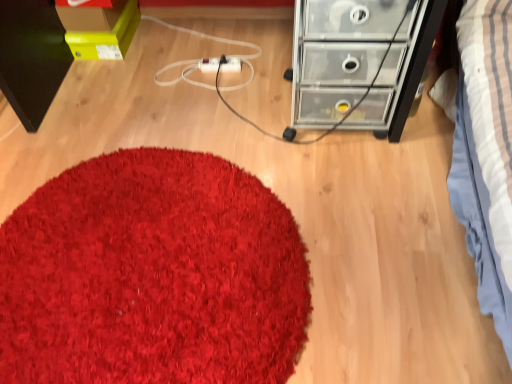
Question: Can shaggy red carpet at center be found inside transparent plastic chest of drawers at upper right?

Choices:
 (A) yes
 (B) no

Answer: (B)

Question: From a real-world perspective, is transparent plastic chest of drawers at upper right under shaggy red carpet at center?

Choices:
 (A) yes
 (B) no

Answer: (B)

Question: Are transparent plastic chest of drawers at upper right and shaggy red carpet at center beside each other?

Choices:
 (A) no
 (B) yes

Answer: (A)

Question: Considering the relative sizes of transparent plastic chest of drawers at upper right and shaggy red carpet at center in the image provided, is transparent plastic chest of drawers at upper right shorter than shaggy red carpet at center?

Choices:
 (A) yes
 (B) no

Answer: (B)

Question: Does transparent plastic chest of drawers at upper right have a lesser width compared to shaggy red carpet at center?

Choices:
 (A) yes
 (B) no

Answer: (A)

Question: Considering their positions, is transparent plastic chest of drawers at upper right located in front of or behind shaggy red carpet at center?

Choices:
 (A) front
 (B) behind

Answer: (B)

Question: Is transparent plastic chest of drawers at upper right wider or thinner than shaggy red carpet at center?

Choices:
 (A) wide
 (B) thin

Answer: (B)

Question: Would you say transparent plastic chest of drawers at upper right is inside or outside shaggy red carpet at center?

Choices:
 (A) outside
 (B) inside

Answer: (A)

Question: From a real-world perspective, is transparent plastic chest of drawers at upper right positioned above or below shaggy red carpet at center?

Choices:
 (A) below
 (B) above

Answer: (B)

Question: From the image's perspective, is shaggy red carpet at center located above or below transparent plastic chest of drawers at upper right?

Choices:
 (A) below
 (B) above

Answer: (A)

Question: In terms of height, does shaggy red carpet at center look taller or shorter compared to transparent plastic chest of drawers at upper right?

Choices:
 (A) short
 (B) tall

Answer: (A)

Question: Looking at their shapes, would you say shaggy red carpet at center is wider or thinner than transparent plastic chest of drawers at upper right?

Choices:
 (A) wide
 (B) thin

Answer: (A)

Question: Considering the positions of shaggy red carpet at center and transparent plastic chest of drawers at upper right in the image, is shaggy red carpet at center bigger or smaller than transparent plastic chest of drawers at upper right?

Choices:
 (A) big
 (B) small

Answer: (B)

Question: From a real-world perspective, is transparent plastic chest of drawers at upper right above or below white plastic extension cord at center?

Choices:
 (A) below
 (B) above

Answer: (B)

Question: Considering the positions of point (353, 28) and point (205, 67), is point (353, 28) closer or farther from the camera than point (205, 67)?

Choices:
 (A) closer
 (B) farther

Answer: (A)